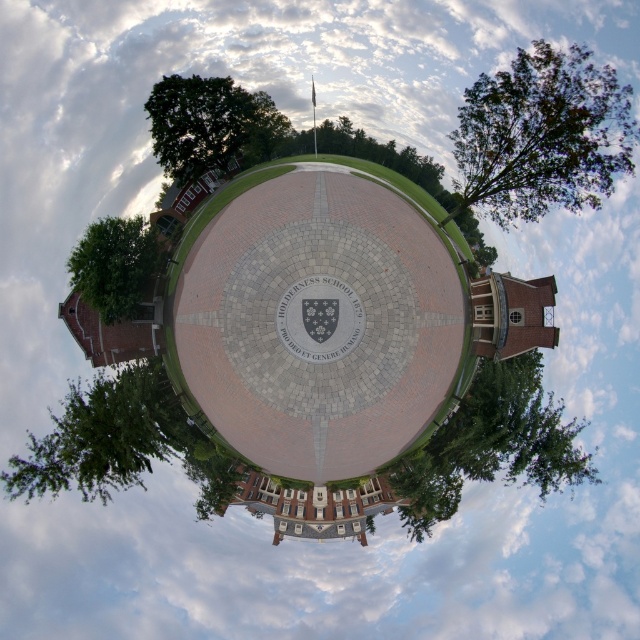
You are standing at the center of the circular brick plaza and want to find the gray stone clock at center. Which direction should you look to see the green leafy tree at upper left relative to the clock?

The green leafy tree at upper left is to the left of the gray stone clock at center, so you should look to the left of the clock to see the tree.

You are standing in the center of the circular brick plaza at HOLDERNESS SCHOOL. You see two green leafy trees in the scene. One is labeled as the green leafy tree at upper right and the other as the green leafy tree at lower left. From your vantage point, which tree is positioned to the right of the other?

The green leafy tree at upper right is positioned to the right of the green leafy tree at lower left.